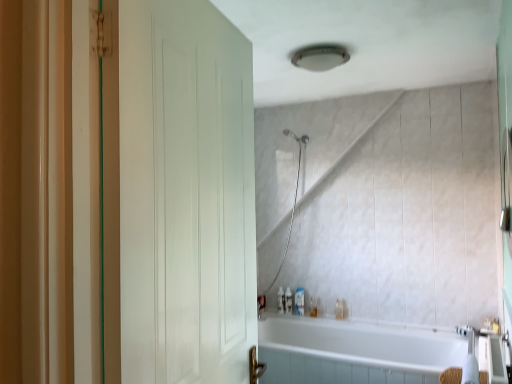
Identify the location of vacant space in between translucent plastic soap at lower center, positioned as the fifth toiletry in left-to-right order, and translucent plastic bottle at lower center, the 1th toiletry positioned from the right. This screenshot has height=384, width=512. (326, 315).